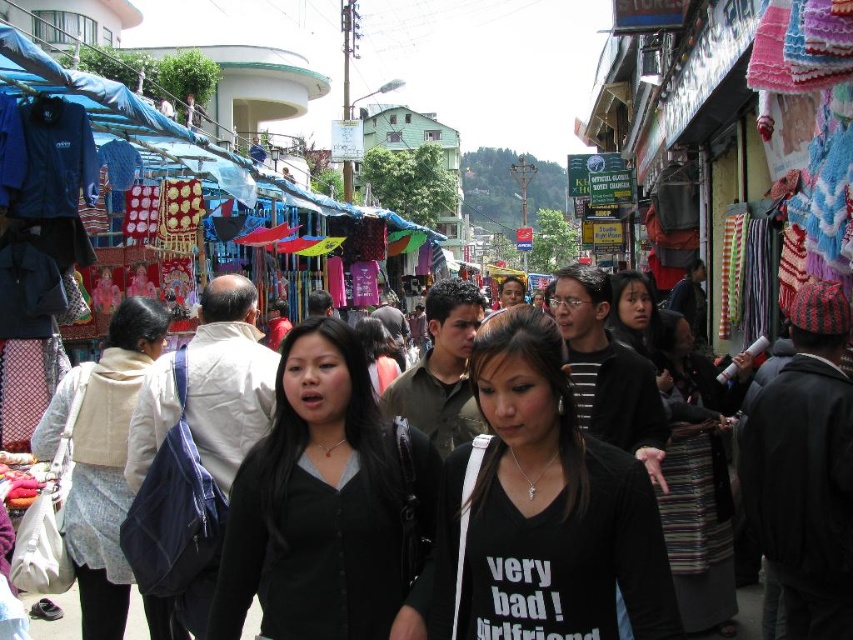
Where is the black matte shirt at center located in the image?

The black matte shirt at center is located at point (540, 509) in the image.

You are a traveler who wants to buy a souvenir for your friend. You see a beige fabric bag at center and a striped fabric skirt at center. Which item is narrower?

The beige fabric bag at center is narrower than the striped fabric skirt at center.

You are standing at the point labeled as point (540, 509) in the image. What object is directly in front of you?

The black matte shirt at center is directly in front of you at point (540, 509).